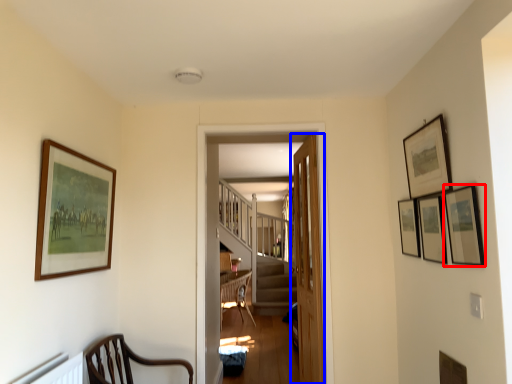
Question: Among these objects, which one is farthest to the camera, picture frame (highlighted by a red box) or door (highlighted by a blue box)?

Choices:
 (A) picture frame
 (B) door

Answer: (B)